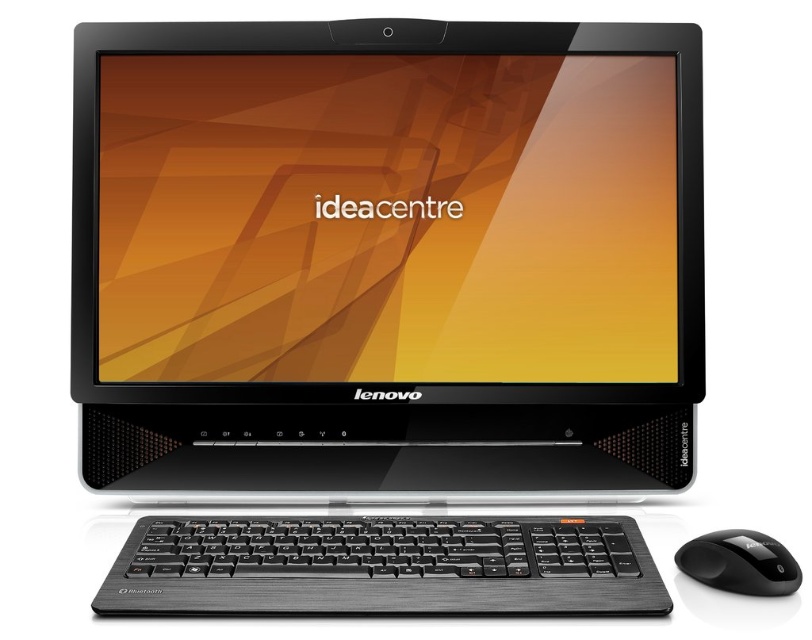
The height and width of the screenshot is (640, 812). In order to click on black brushed metal keyboard at lower center in this screenshot , I will do `click(382, 566)`.

Who is lower down, black brushed metal keyboard at lower center or black plastic mouse at lower right?

black brushed metal keyboard at lower center is below.

Where is `black brushed metal keyboard at lower center`? This screenshot has width=812, height=640. black brushed metal keyboard at lower center is located at coordinates (382, 566).

Does point (322, 52) lie behind point (748, 580)?

Yes.

Is black matte laptop at center above black plastic mouse at lower right?

Yes.

At what (x,y) coordinates should I click in order to perform the action: click on black matte laptop at center. Please return your answer as a coordinate pair (x, y). This screenshot has width=812, height=640. Looking at the image, I should click on (387, 259).

Does black matte laptop at center have a greater width compared to black brushed metal keyboard at lower center?

Correct, the width of black matte laptop at center exceeds that of black brushed metal keyboard at lower center.

Is black matte laptop at center smaller than black brushed metal keyboard at lower center?

No.

Does point (113, 467) come closer to viewer compared to point (318, 541)?

No.

The width and height of the screenshot is (812, 640). I want to click on black matte laptop at center, so click(387, 259).